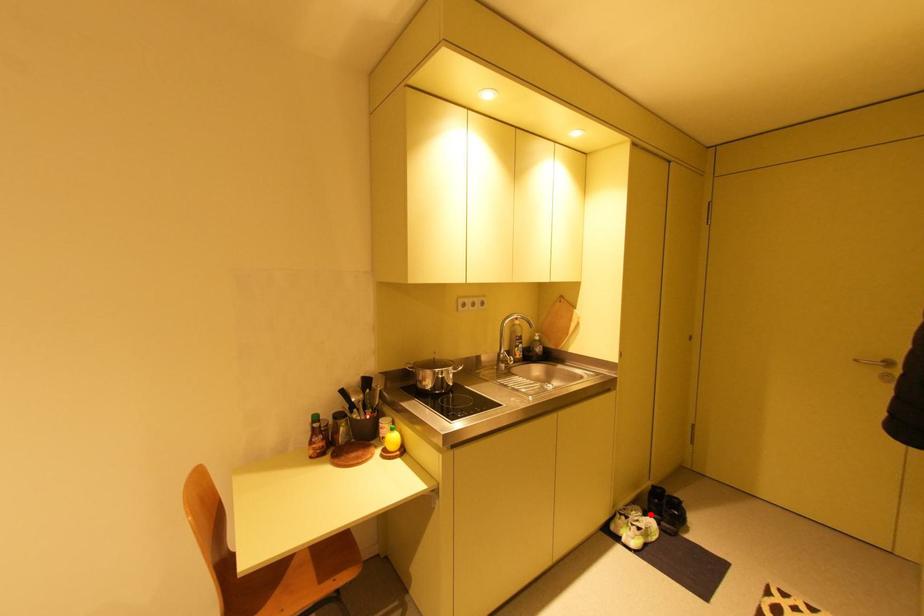
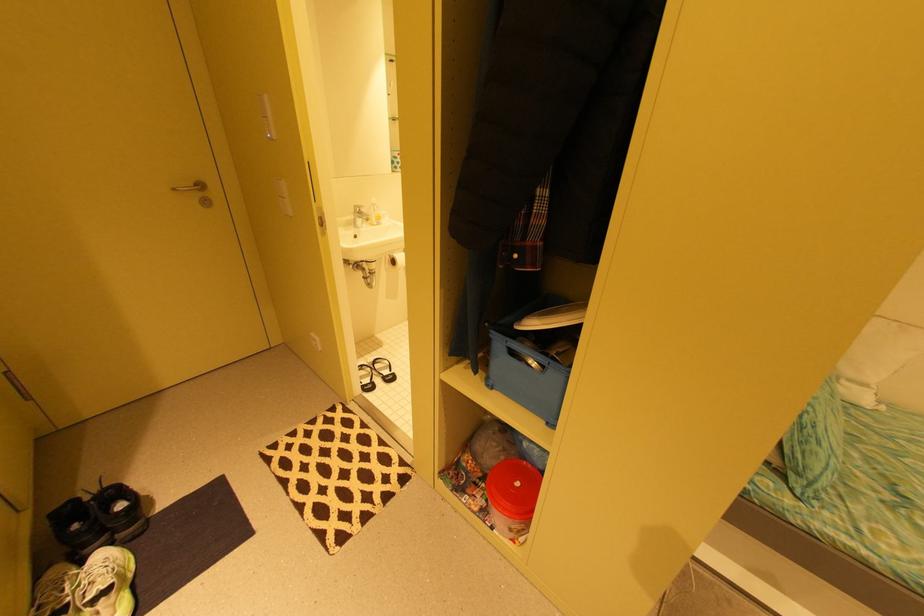
Question: I am providing you with two images of the same scene from different viewpoints. In image1, a red point is highlighted. Considering the same 3D point in image2, which of the following is correct?

Choices:
 (A) It is closer
 (B) It is farther

Answer: (B)